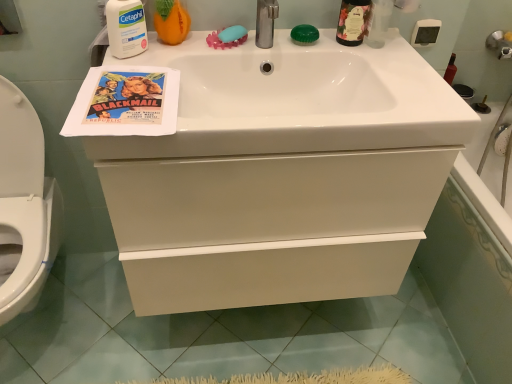
Where is `vacant point to the right of green glossy soap at upper center, which ranks as the first soap in right-to-left order`? vacant point to the right of green glossy soap at upper center, which ranks as the first soap in right-to-left order is located at coordinates (354, 46).